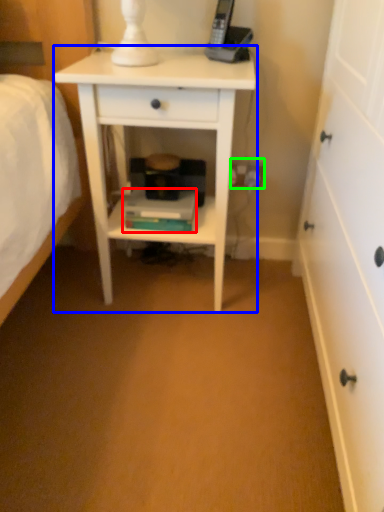
Question: Estimate the real-world distances between objects in this image. Which object is farther from book (highlighted by a red box), nightstand (highlighted by a blue box) or electric outlet (highlighted by a green box)?

Choices:
 (A) nightstand
 (B) electric outlet

Answer: (B)